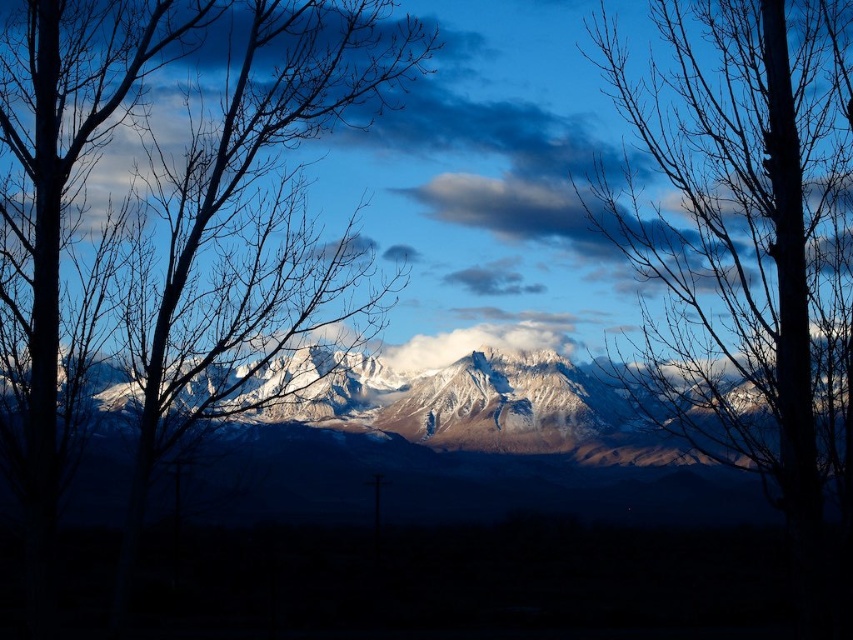
Can you confirm if bare branches at center is positioned to the left of silhouette bare branches at left?

No, bare branches at center is not to the left of silhouette bare branches at left.

Where is `bare branches at center`? The height and width of the screenshot is (640, 853). bare branches at center is located at coordinates (744, 230).

Is point (721, 308) more distant than point (502, 401)?

No, it is in front of (502, 401).

Find the location of `bare branches at center`. bare branches at center is located at coordinates 744,230.

Between silhouette bare branches at left and snowy rock mountain range at center, which one is positioned higher?

silhouette bare branches at left is above.

Is silhouette bare branches at left above snowy rock mountain range at center?

Indeed, silhouette bare branches at left is positioned over snowy rock mountain range at center.

Image resolution: width=853 pixels, height=640 pixels. Identify the location of silhouette bare branches at left. (152, 193).